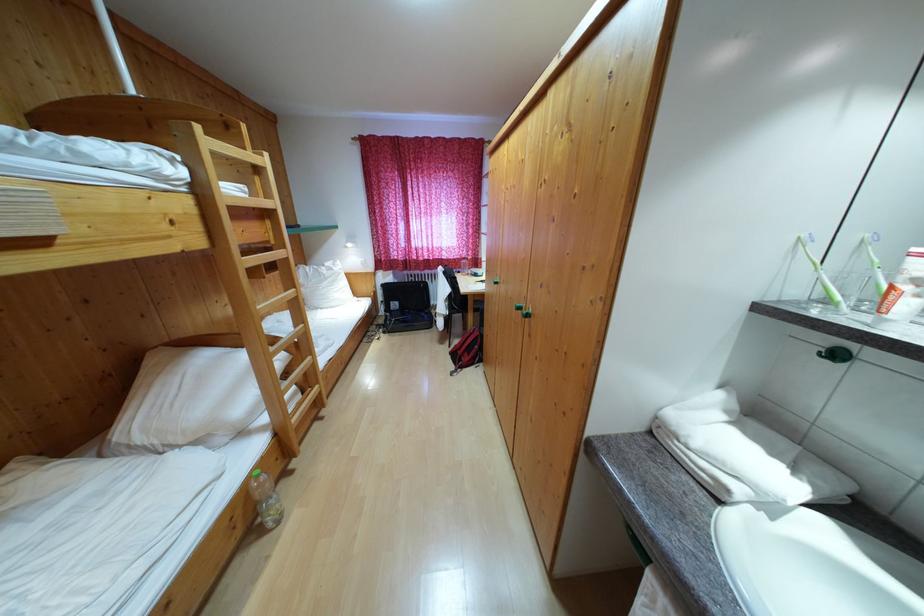
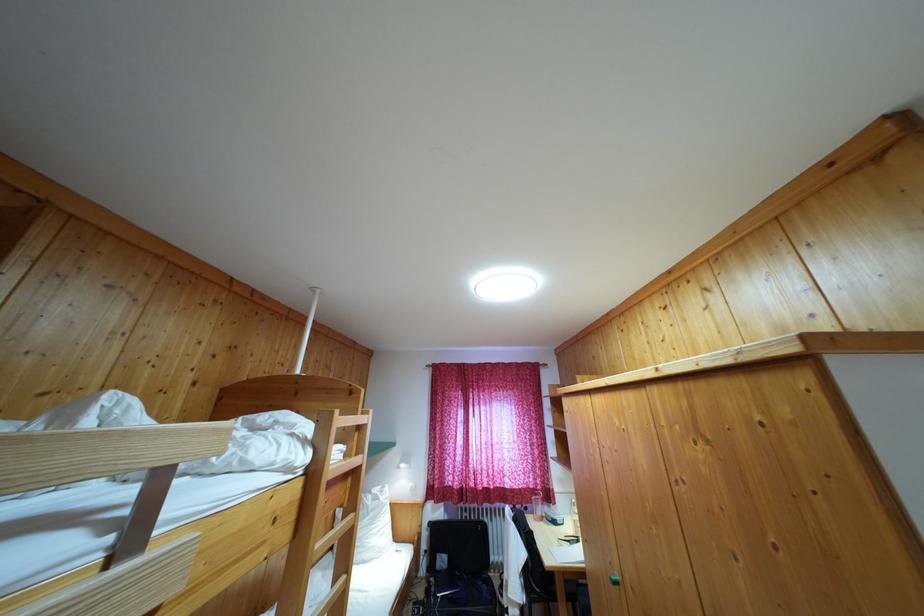
The point at (398, 312) is marked in the first image. Where is the corresponding point in the second image?

(445, 567)